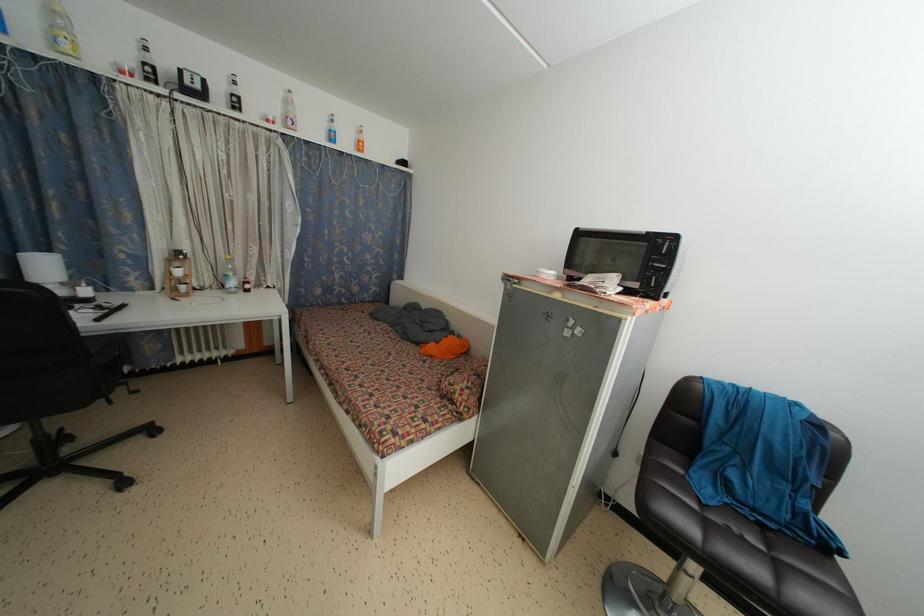
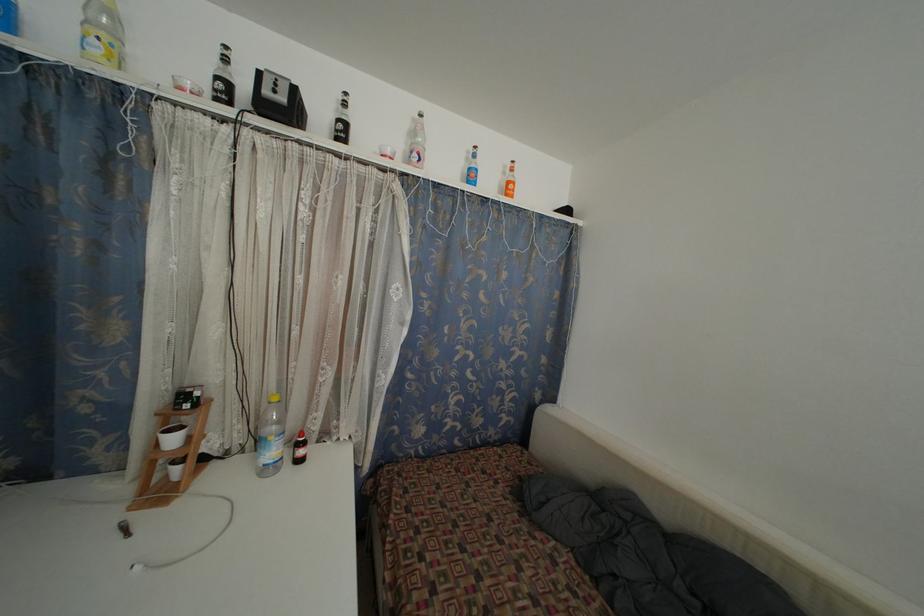
In the second image, find the point that corresponds to the point at 362,147 in the first image.

(513, 188)